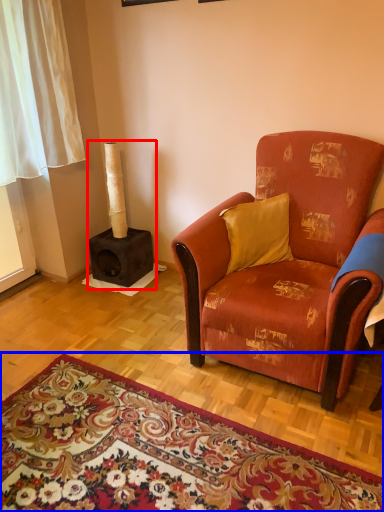
Question: Which point is closer to the camera, fireplace (highlighted by a red box) or mat (highlighted by a blue box)?

Choices:
 (A) fireplace
 (B) mat

Answer: (B)